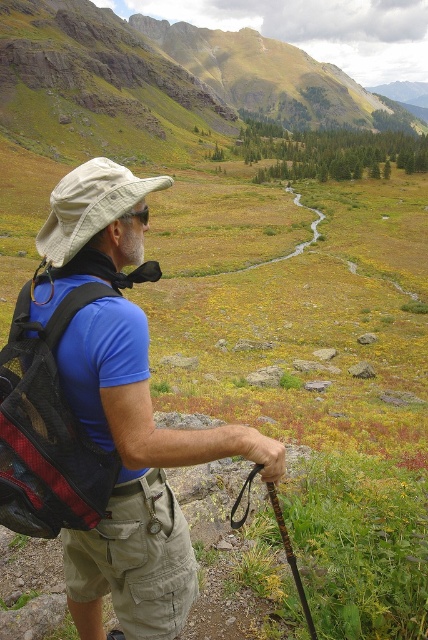
Question: Does red mesh backpack at left appear on the left side of khakimaterial/texture shorts at lower center?

Choices:
 (A) no
 (B) yes

Answer: (B)

Question: Which point is farther to the camera?

Choices:
 (A) khakimaterial/texture shorts at lower center
 (B) red mesh backpack at left
 (C) matte blue shirt at center

Answer: (A)

Question: Is matte blue shirt at center above red mesh backpack at left?

Choices:
 (A) yes
 (B) no

Answer: (A)

Question: Which of these objects is positioned farthest from the red mesh backpack at left?

Choices:
 (A) matte blue shirt at center
 (B) khakimaterial/texture shorts at lower center

Answer: (A)

Question: Is matte blue shirt at center wider than khakimaterial/texture shorts at lower center?

Choices:
 (A) no
 (B) yes

Answer: (B)

Question: Among these objects, which one is farthest from the camera?

Choices:
 (A) khakimaterial/texture shorts at lower center
 (B) red mesh backpack at left

Answer: (A)